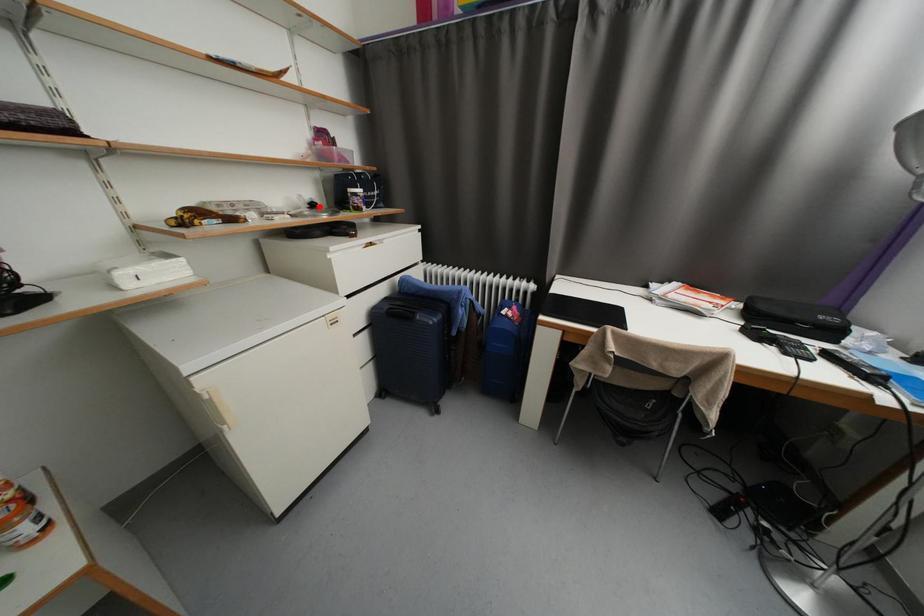
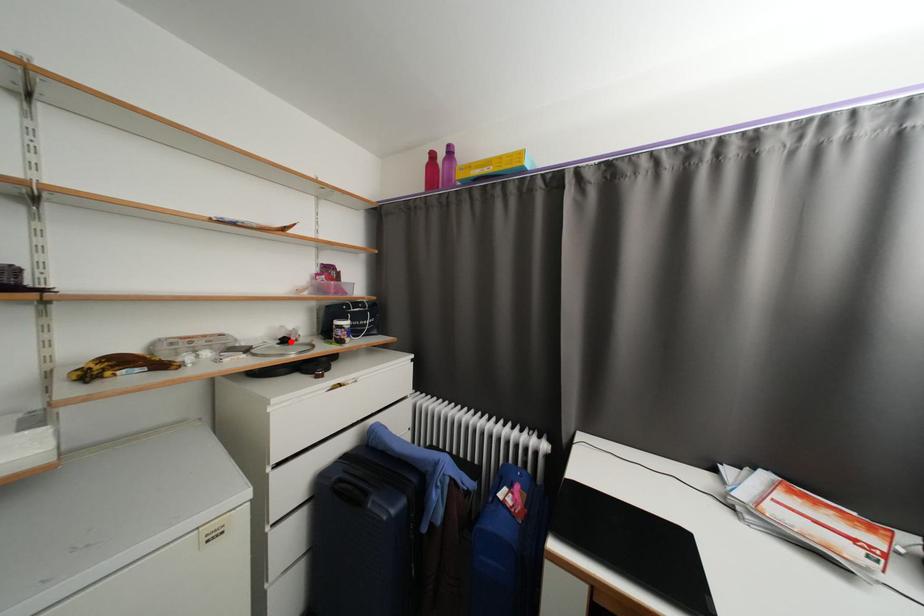
I am providing you with two images of the same scene from different viewpoints. A red point is marked on the first image and another point is marked on the second image. Does the point marked in image1 correspond to the same location as the one in image2?

Yes